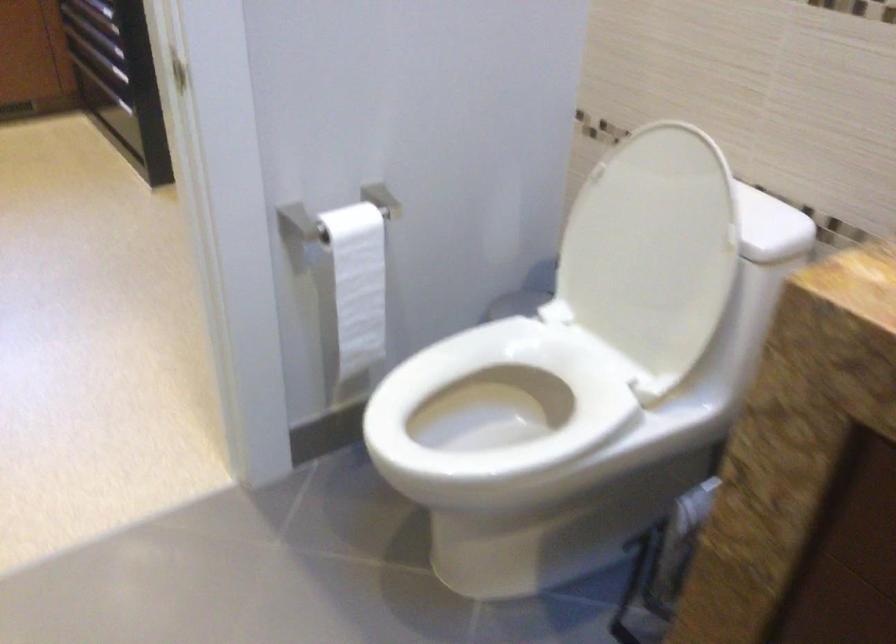
Where would you lift the white toilet seat? Please return your answer as a coordinate pair (x, y).

(497, 413)